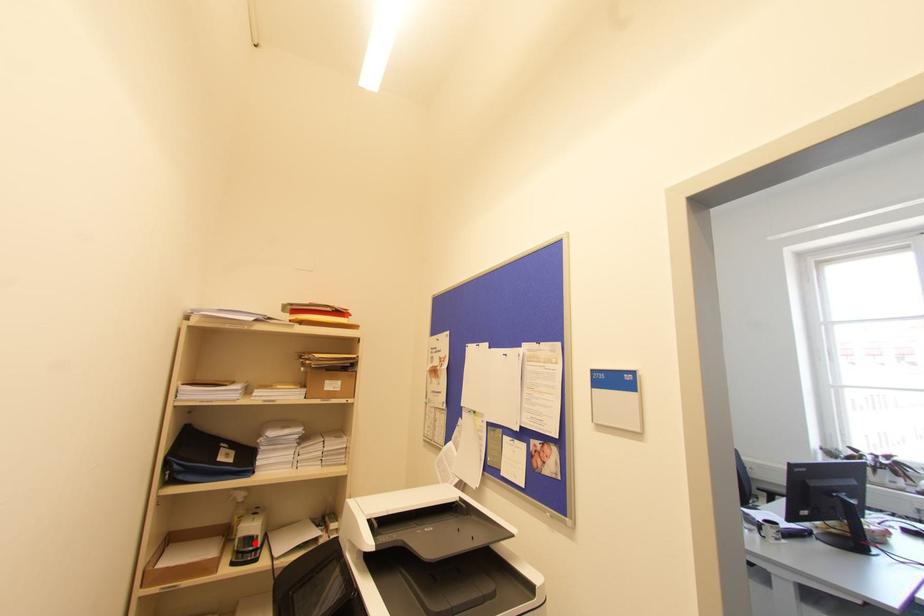
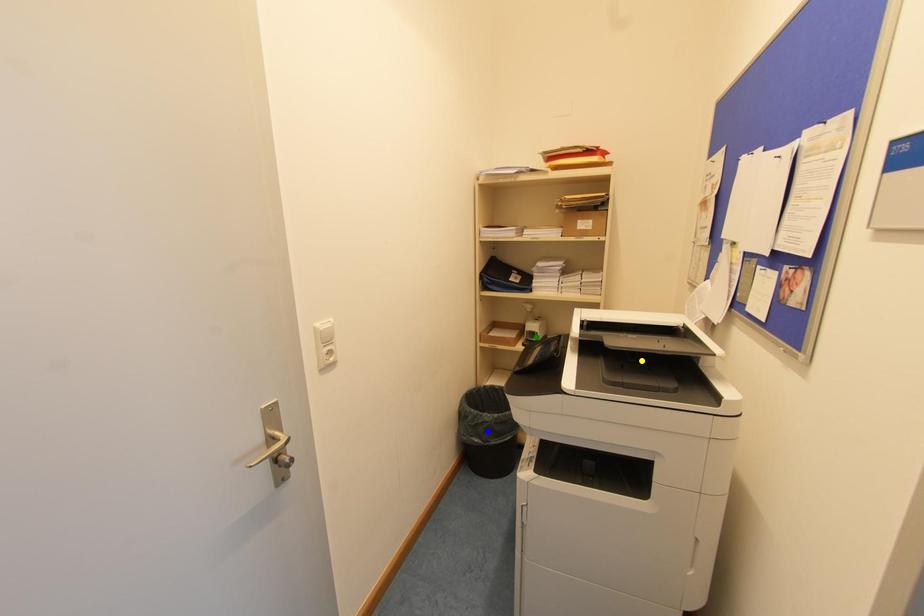
Question: I am providing you with two images of the same scene from different viewpoints. A red point is marked on the first image. You are given multiple points on the second image. Can you choose the point in image 2 that corresponds to the point in image 1?

Choices:
 (A) green point
 (B) yellow point
 (C) blue point

Answer: (A)